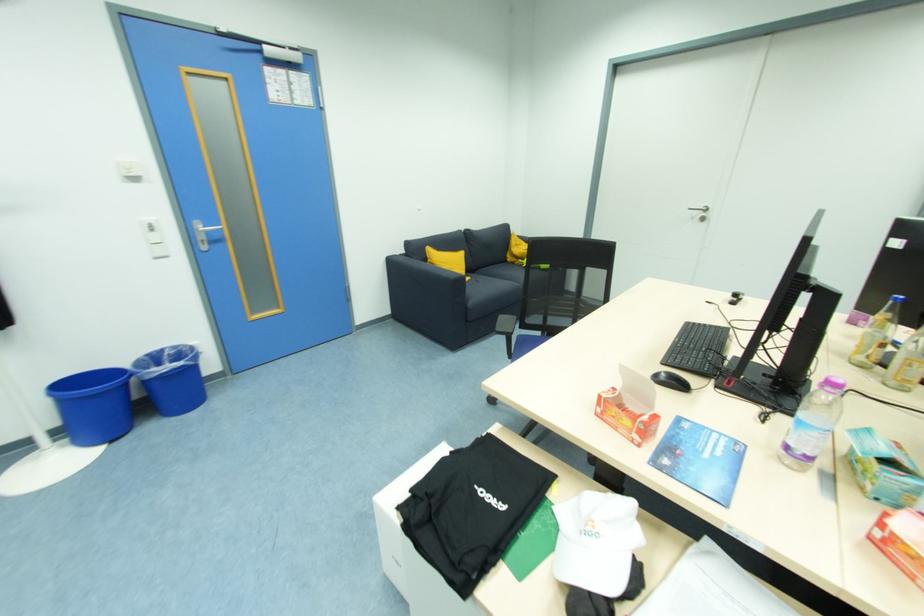
Where would you lift the blue trash bin? Please return your answer as a coordinate pair (x, y).

(172, 379)